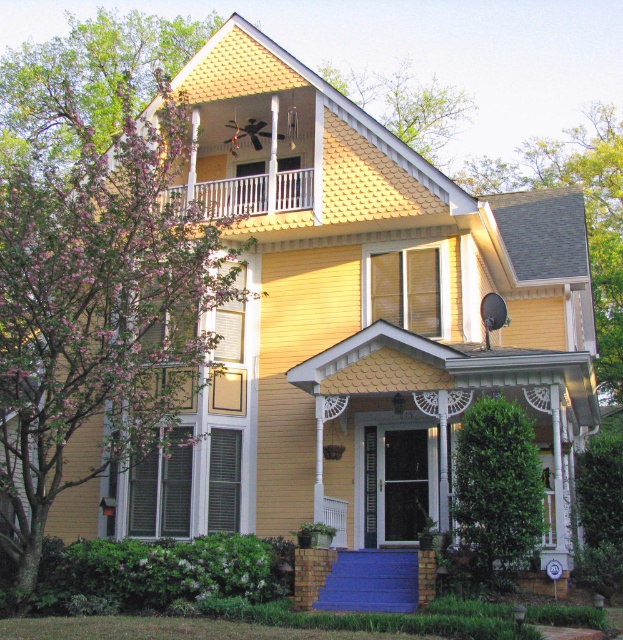
Consider the image. Is white painted wood shutter at center in front of white metal railing at upper center?

That is True.

Consider the image. Is white painted wood shutter at center smaller than white metal railing at upper center?

Correct, white painted wood shutter at center occupies less space than white metal railing at upper center.

You are a GUI agent. You are given a task and a screenshot of the screen. Output one action in this format:
    pyautogui.click(x=<x>, y=<y>)
    Task: Click on the white painted wood shutter at center
    This screenshot has width=623, height=640.
    Given the screenshot: What is the action you would take?
    pyautogui.click(x=406, y=289)

Is green leafy tree at upper right smaller than green leafy bush at lower right?

Actually, green leafy tree at upper right might be larger than green leafy bush at lower right.

Is green leafy tree at upper right below green leafy bush at lower right?

No.

Find the location of a particular element. The image size is (623, 640). green leafy tree at upper right is located at coordinates (584, 211).

I want to click on green leafy tree at upper right, so click(x=584, y=211).

Is green leafy bush at lower right below green matte shutter at left?

No, green leafy bush at lower right is not below green matte shutter at left.

Who is more distant from viewer, (x=513, y=472) or (x=151, y=531)?

Positioned behind is point (x=151, y=531).

Who is more forward, [516,563] or [168,440]?

Point [516,563] is more forward.

The height and width of the screenshot is (640, 623). Identify the location of green leafy bush at lower right. (497, 484).